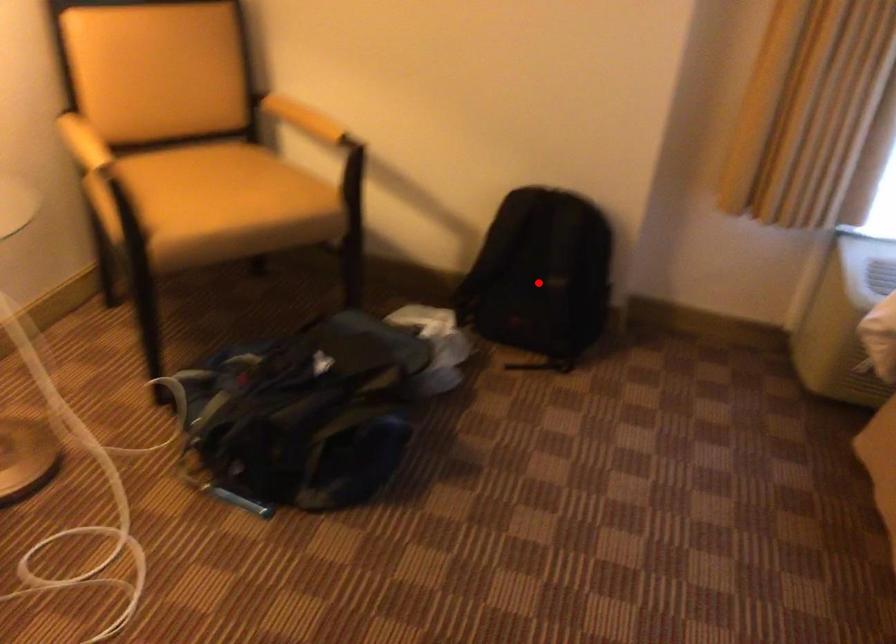
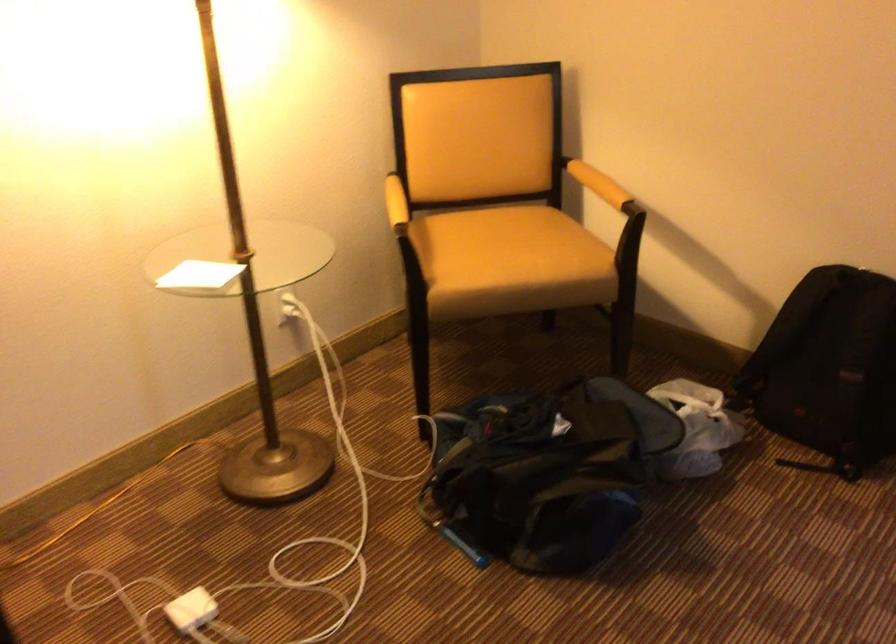
Locate, in the second image, the point that corresponds to the highlighted location in the first image.

(829, 368)